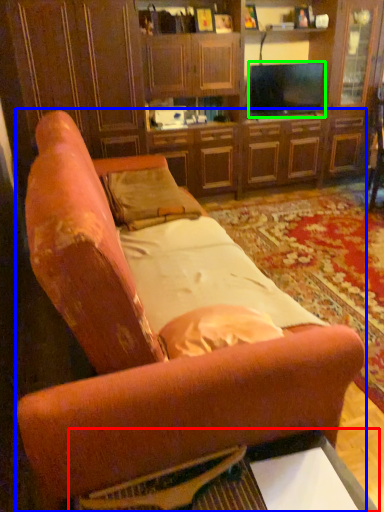
Question: Which object is the farthest from table (highlighted by a red box)? Choose among these: studio couch (highlighted by a blue box) or television (highlighted by a green box).

Choices:
 (A) studio couch
 (B) television

Answer: (B)